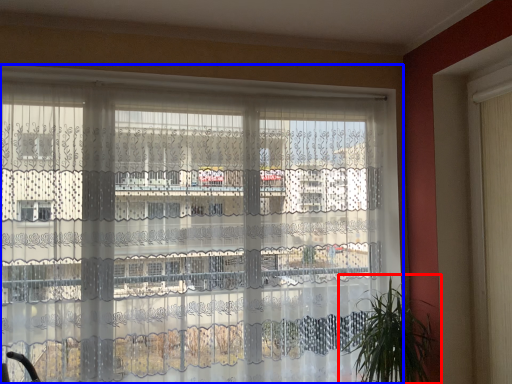
Question: Which point is closer to the camera, houseplant (highlighted by a red box) or window (highlighted by a blue box)?

Choices:
 (A) houseplant
 (B) window

Answer: (B)